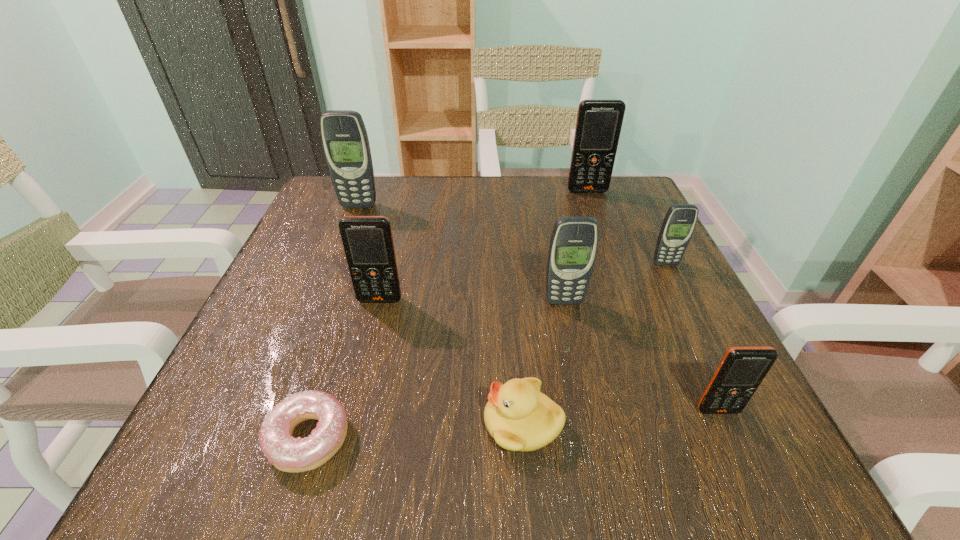
I want to click on object positioned at the far left corner, so click(344, 137).

The height and width of the screenshot is (540, 960). Find the location of `object at the near left corner`. object at the near left corner is located at coordinates (288, 454).

Identify the location of object that is at the far right corner. This screenshot has height=540, width=960. (599, 122).

What are the coordinates of `vacant space at the far edge of the desktop` in the screenshot? It's located at (401, 205).

This screenshot has height=540, width=960. What are the coordinates of `free point at the near edge` in the screenshot? It's located at (618, 472).

At what (x,y) coordinates should I click in order to perform the action: click on vacant space at the left edge of the desktop. Please return your answer as a coordinate pair (x, y). This screenshot has height=540, width=960. Looking at the image, I should click on (290, 269).

The height and width of the screenshot is (540, 960). Find the location of `vacant region at the right edge`. vacant region at the right edge is located at coordinates (644, 278).

Identify the location of vacant space at the far left corner of the desktop. pos(315,204).

Locate an element on the screen. This screenshot has height=540, width=960. vacant space at the near left corner is located at coordinates tap(197, 464).

In the image, there is a desktop. In order to click on vacant area at the far right corner in this screenshot , I will do `click(634, 190)`.